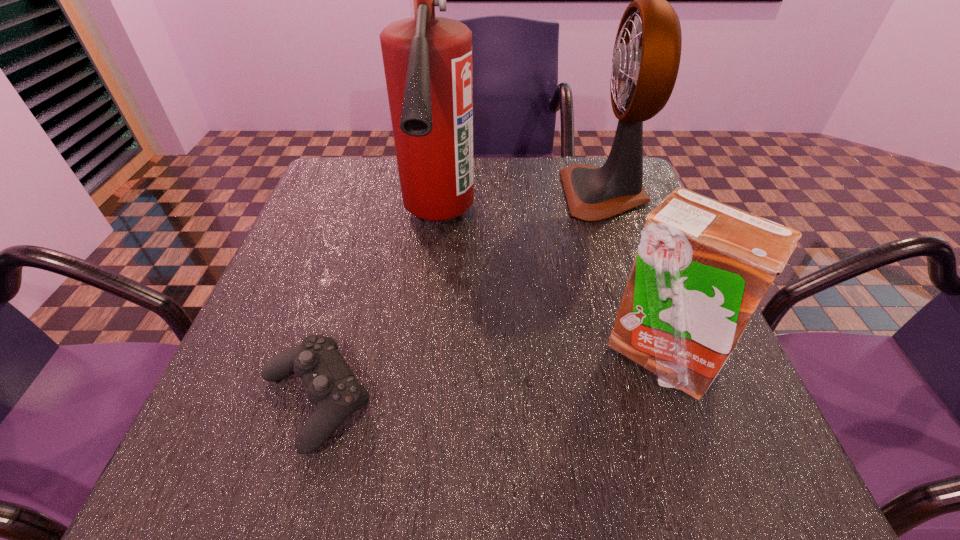
Locate an element on the screen. vacant space at the left edge of the desktop is located at coordinates (303, 210).

Where is `free space at the right edge`? free space at the right edge is located at coordinates (721, 412).

The height and width of the screenshot is (540, 960). I want to click on vacant space at the near right corner, so click(757, 480).

Where is `vacant space that's between the shortest object and the fire extinguisher`? This screenshot has height=540, width=960. vacant space that's between the shortest object and the fire extinguisher is located at coordinates (376, 310).

Where is `empty space between the control and the fire extinguisher`? The height and width of the screenshot is (540, 960). empty space between the control and the fire extinguisher is located at coordinates (376, 310).

Image resolution: width=960 pixels, height=540 pixels. I want to click on blank region between the third shortest object and the control, so click(x=461, y=296).

Identify the location of free space between the tallest object and the shortest object. This screenshot has width=960, height=540. (376, 310).

At what (x,y) coordinates should I click in order to perform the action: click on free space between the shortest object and the fan. Please return your answer as a coordinate pair (x, y). Looking at the image, I should click on (461, 296).

Where is `vacant region between the tallest object and the shortest object`? vacant region between the tallest object and the shortest object is located at coordinates (376, 310).

Identify the location of free space between the tallest object and the shortest object. The width and height of the screenshot is (960, 540). (376, 310).